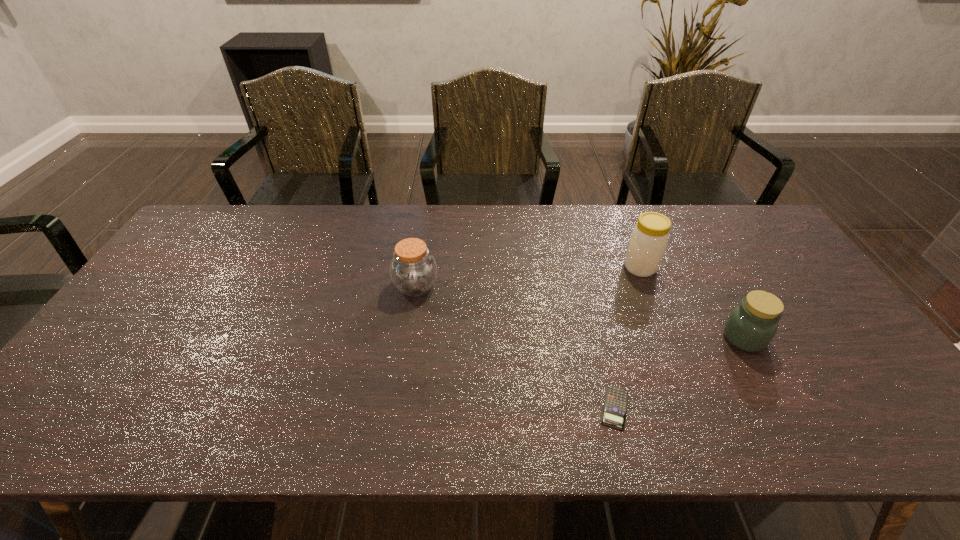
Identify the location of jar that is the closest to the nearest jar. (649, 238).

Identify which jar is the nearest to the shortest object. Please provide its 2D coordinates. Your answer should be formatted as a tuple, i.e. [(x, y)], where the tuple contains the x and y coordinates of a point satisfying the conditions above.

[(751, 326)]

This screenshot has width=960, height=540. Find the location of `vacant space that satisfies the following two spatial constraints: 1. on the front side of the leftmost jar; 2. on the left side of the rightmost object`. vacant space that satisfies the following two spatial constraints: 1. on the front side of the leftmost jar; 2. on the left side of the rightmost object is located at coordinates (408, 338).

Where is `vacant point that satisfies the following two spatial constraints: 1. on the back side of the third object from left to right; 2. on the left side of the calculator`? The height and width of the screenshot is (540, 960). vacant point that satisfies the following two spatial constraints: 1. on the back side of the third object from left to right; 2. on the left side of the calculator is located at coordinates (580, 267).